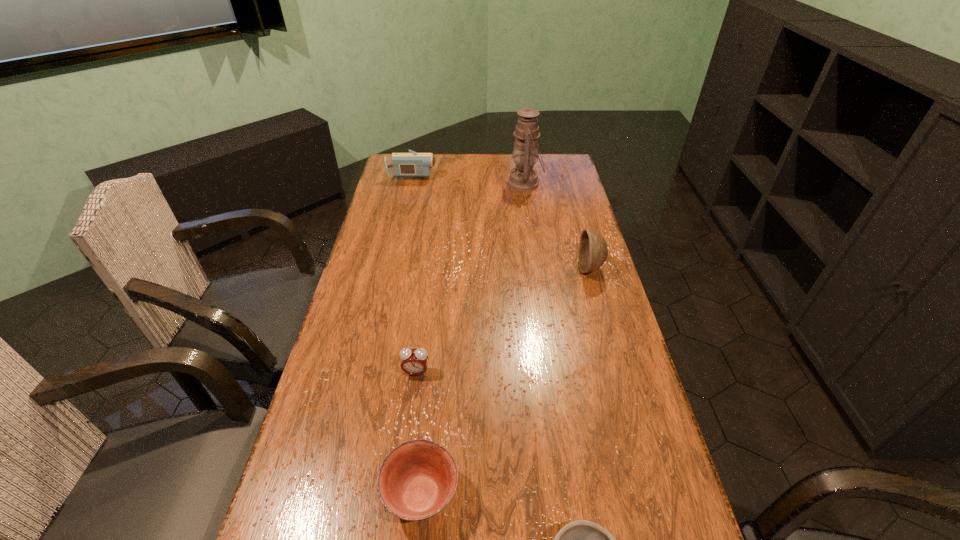
The image size is (960, 540). I want to click on vacant region located on the clock face of the alarm clock, so click(x=409, y=428).

Find the location of `free region located on the back of the second tallest bowl`. free region located on the back of the second tallest bowl is located at coordinates (429, 413).

The image size is (960, 540). In order to click on oil lamp situated at the far edge in this screenshot , I will do `click(523, 178)`.

This screenshot has width=960, height=540. I want to click on camcorder present at the far edge, so click(x=412, y=164).

Image resolution: width=960 pixels, height=540 pixels. Identify the location of object that is at the left edge. (412, 164).

Find the location of a particular element. oil lamp situated at the right edge is located at coordinates (523, 178).

Locate an element on the screen. The height and width of the screenshot is (540, 960). bowl positioned at the right edge is located at coordinates (593, 250).

Where is `object at the far left corner`? object at the far left corner is located at coordinates (412, 164).

What are the coordinates of `object situated at the far right corner` in the screenshot? It's located at (523, 178).

Locate an element on the screen. vacant space at the far edge is located at coordinates (483, 162).